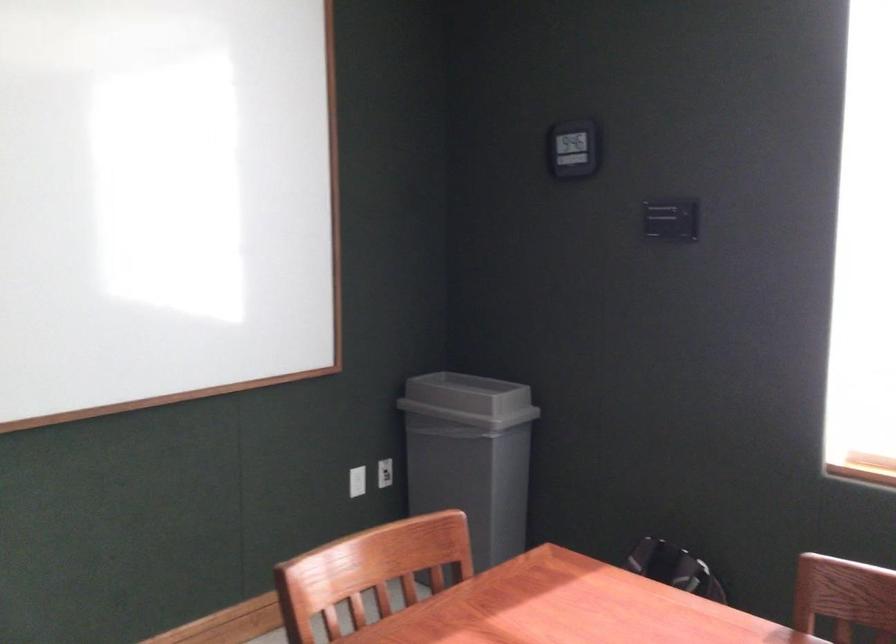
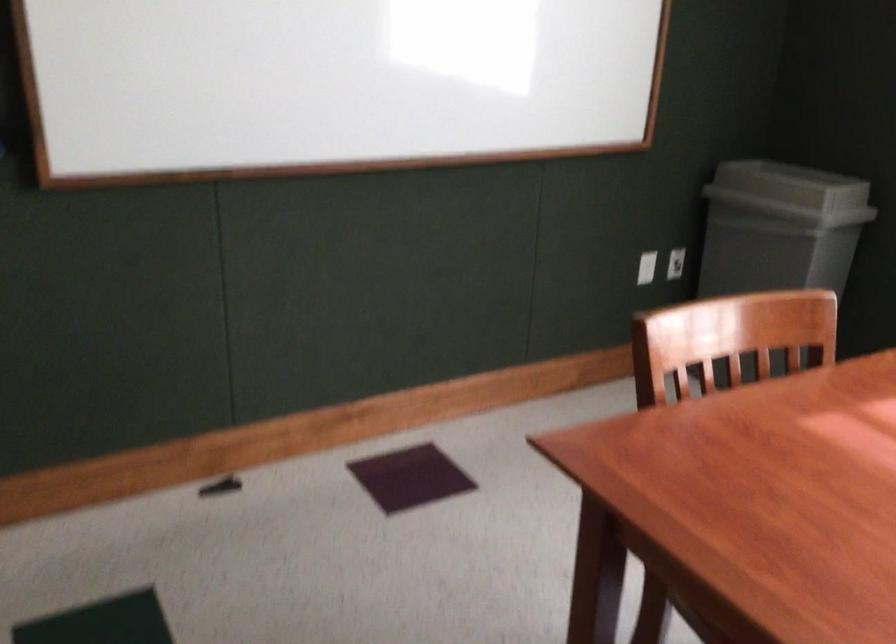
Question: The camera is either moving clockwise (left) or counter-clockwise (right) around the object. The first image is from the beginning of the video and the second image is from the end. Is the camera moving left or right when shooting the video?

Choices:
 (A) Left
 (B) Right

Answer: (B)